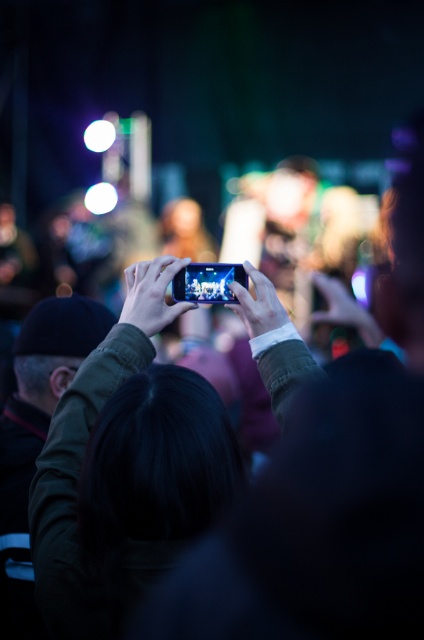
You are standing at the point with coordinates point (181, 278) and want to take a photo of the stage. There is a person holding a phone at point (270, 356). Will this person block your view of the stage?

Point (270, 356) is in front of point (181, 278), so the person at point (270, 356) will block your view of the stage.

You are at a concert and want to record the performance using your phone. You have two phones available, the shiny black phone at center and the matte black phone at upper center. Which phone should you choose if you want to capture more of the stage in a single shot?

The shiny black phone at center is larger in size than the matte black phone at upper center, so you should choose the shiny black phone at center to capture more of the stage in a single shot.